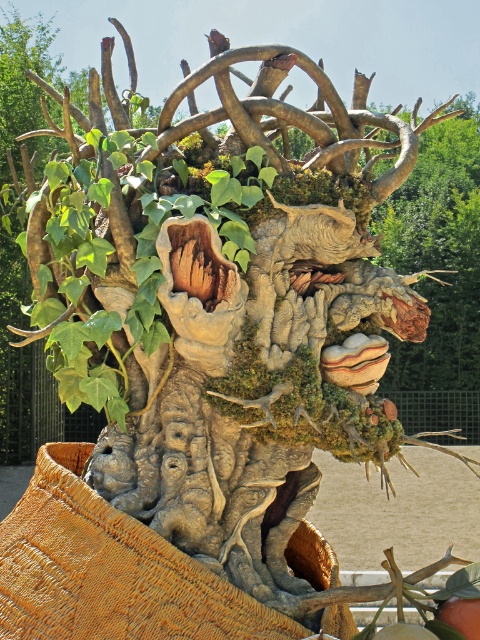
Question: Can you confirm if leather textured basket at lower left is thinner than green matte fruit at lower center?

Choices:
 (A) no
 (B) yes

Answer: (A)

Question: Which of the following is the closest to the observer?

Choices:
 (A) green matte fruit at lower center
 (B) leather textured basket at lower left

Answer: (A)

Question: Does leather textured basket at lower left lie in front of green matte fruit at lower center?

Choices:
 (A) yes
 (B) no

Answer: (B)

Question: Estimate the real-world distances between objects in this image. Which object is closer to the green matte fruit at lower center?

Choices:
 (A) leather textured basket at lower left
 (B) green matte fruit at center

Answer: (B)

Question: Observing the image, what is the correct spatial positioning of leather textured basket at lower left in reference to green matte fruit at lower center?

Choices:
 (A) below
 (B) above

Answer: (B)

Question: Which object is positioned closest to the green matte fruit at lower center?

Choices:
 (A) leather textured basket at lower left
 (B) green matte fruit at center

Answer: (B)